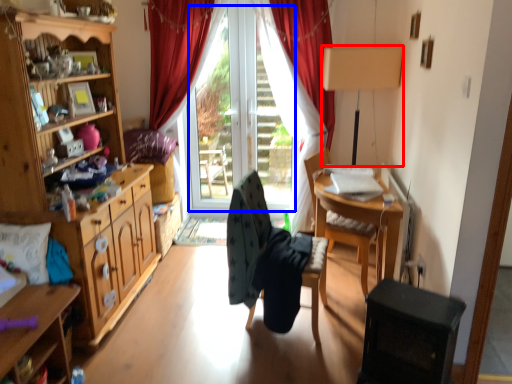
Question: Which object is closer to the camera taking this photo, lamp (highlighted by a red box) or window screen (highlighted by a blue box)?

Choices:
 (A) lamp
 (B) window screen

Answer: (A)